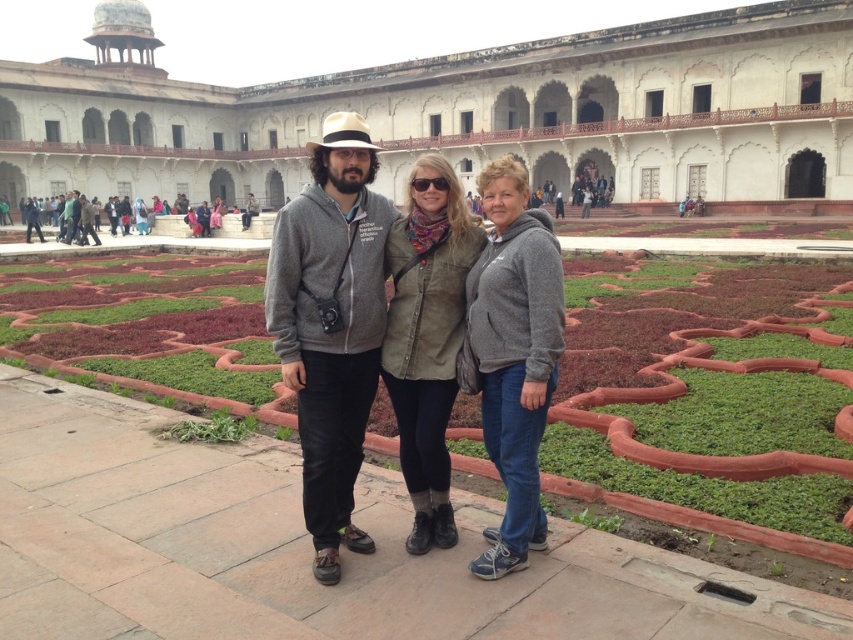
Who is more forward, (509, 342) or (425, 156)?

Point (509, 342) is in front.

Can you confirm if gray fleece jacket at center is taller than olive-green fabric jacket at center?

Indeed, gray fleece jacket at center has a greater height compared to olive-green fabric jacket at center.

Locate an element on the screen. The height and width of the screenshot is (640, 853). gray fleece jacket at center is located at coordinates (514, 355).

Does point (107, 148) come farther from viewer compared to point (380, 262)?

That is True.

Can you confirm if white stone palace at center is wider than gray cotton hoodie at center?

Yes, white stone palace at center is wider than gray cotton hoodie at center.

Who is more forward, (83, 70) or (343, 456)?

Positioned in front is point (343, 456).

This screenshot has height=640, width=853. Find the location of `white stone palace at center`. white stone palace at center is located at coordinates (462, 112).

Who is more distant from viewer, (79, 573) or (386, 387)?

Point (386, 387)

Does point (560, 396) come behind point (392, 250)?

Yes, it is.

Locate an element on the screen. green grass at center is located at coordinates (393, 540).